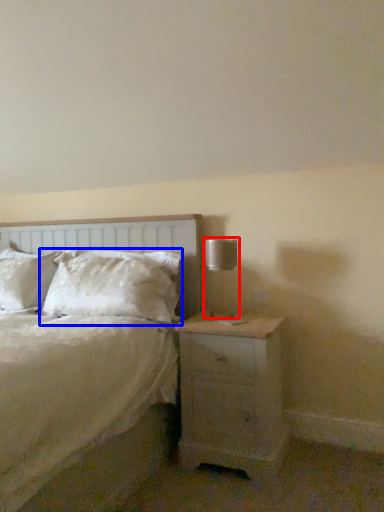
Question: Which of the following is the closest to the observer, table lamp (highlighted by a red box) or pillow (highlighted by a blue box)?

Choices:
 (A) table lamp
 (B) pillow

Answer: (A)